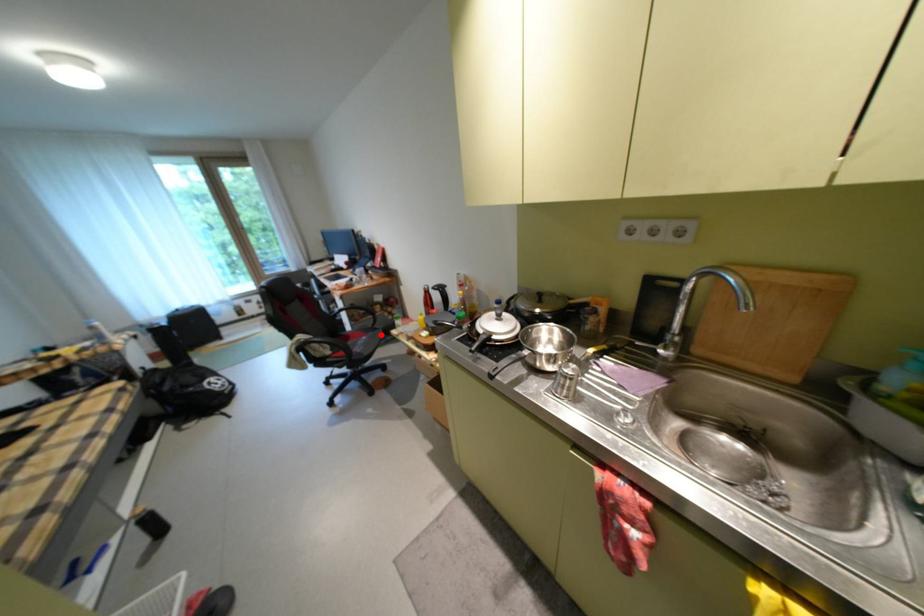
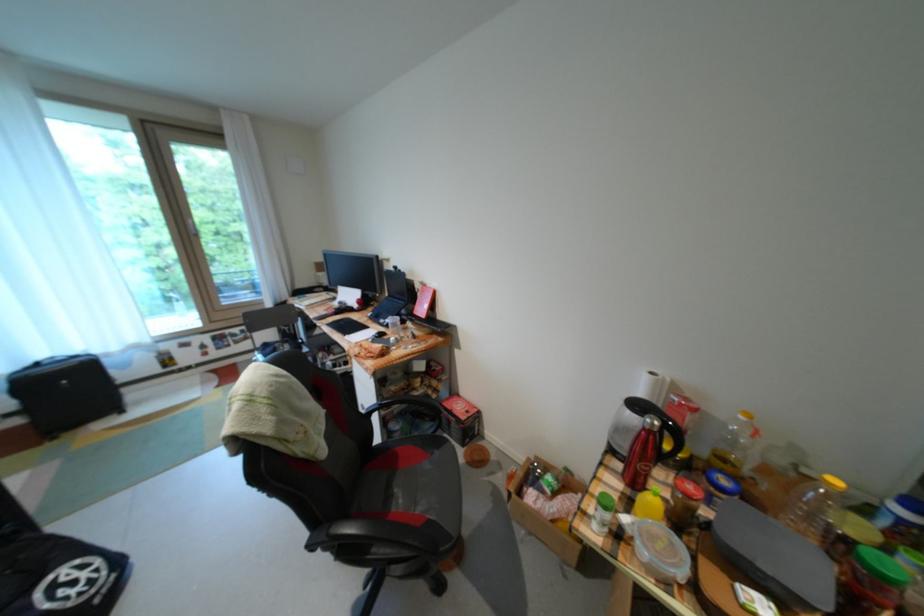
Find the pixel in the second image that matches the highlighted location in the first image.

(446, 455)